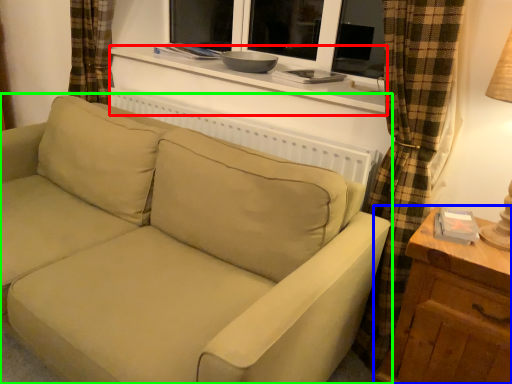
Question: Which object is positioned farthest from window sill (highlighted by a red box)? Select from table (highlighted by a blue box) and studio couch (highlighted by a green box).

Choices:
 (A) table
 (B) studio couch

Answer: (A)